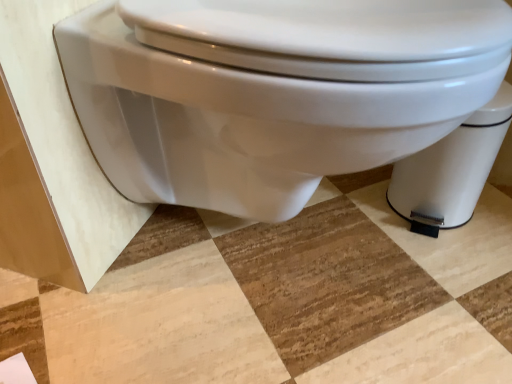
Question: From their relative heights in the image, would you say white glossy toilet at center is taller or shorter than white glossy toilet bowl at lower right?

Choices:
 (A) short
 (B) tall

Answer: (B)

Question: Visually, is white glossy toilet at center positioned to the left or to the right of white glossy toilet bowl at lower right?

Choices:
 (A) right
 (B) left

Answer: (B)

Question: Relative to white glossy toilet bowl at lower right, is white glossy toilet at center in front or behind?

Choices:
 (A) behind
 (B) front

Answer: (B)

Question: From a real-world perspective, is white glossy toilet bowl at lower right physically located above or below white glossy toilet at center?

Choices:
 (A) below
 (B) above

Answer: (A)

Question: Is white glossy toilet bowl at lower right inside the boundaries of white glossy toilet at center, or outside?

Choices:
 (A) inside
 (B) outside

Answer: (B)

Question: In the image, is white glossy toilet bowl at lower right on the left side or the right side of white glossy toilet at center?

Choices:
 (A) right
 (B) left

Answer: (A)

Question: Is white glossy toilet bowl at lower right bigger or smaller than white glossy toilet at center?

Choices:
 (A) small
 (B) big

Answer: (A)